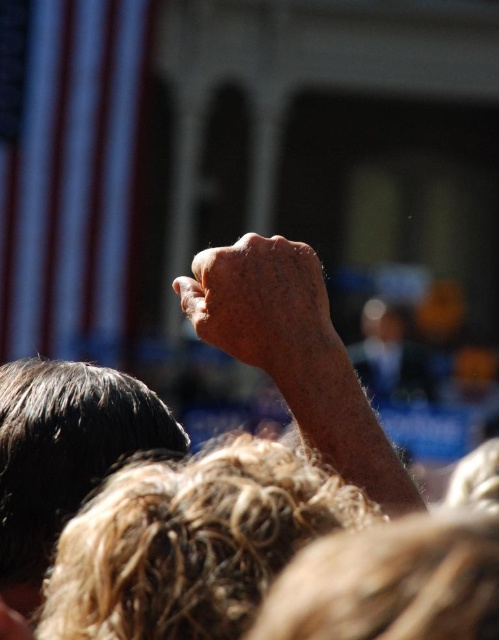
Does dark brown hair at upper left have a smaller size compared to dry skin hand at center?

No.

Is point (44, 460) less distant than point (246, 272)?

Yes, it is in front of point (246, 272).

Is point (117, 440) more distant than point (283, 381)?

Yes, point (117, 440) is farther from viewer.

Where is `dark brown hair at upper left`? This screenshot has width=499, height=640. dark brown hair at upper left is located at coordinates (63, 456).

Does dry skin at center have a greater width compared to dry skin hand at center?

In fact, dry skin at center might be narrower than dry skin hand at center.

Between dry skin at center and dry skin hand at center, which one appears on the left side from the viewer's perspective?

Positioned to the left is dry skin at center.

You are a GUI agent. You are given a task and a screenshot of the screen. Output one action in this format:
    pyautogui.click(x=<x>, y=<y>)
    Task: Click on the dry skin at center
    
    Given the screenshot: What is the action you would take?
    pyautogui.click(x=295, y=355)

From the picture: Is dry skin at center thinner than dark brown hair at upper left?

No.

Between dry skin at center and dark brown hair at upper left, which one appears on the right side from the viewer's perspective?

dry skin at center is more to the right.

What do you see at coordinates (295, 355) in the screenshot?
I see `dry skin at center` at bounding box center [295, 355].

Locate an element on the screen. Image resolution: width=499 pixels, height=640 pixels. dry skin at center is located at coordinates (295, 355).